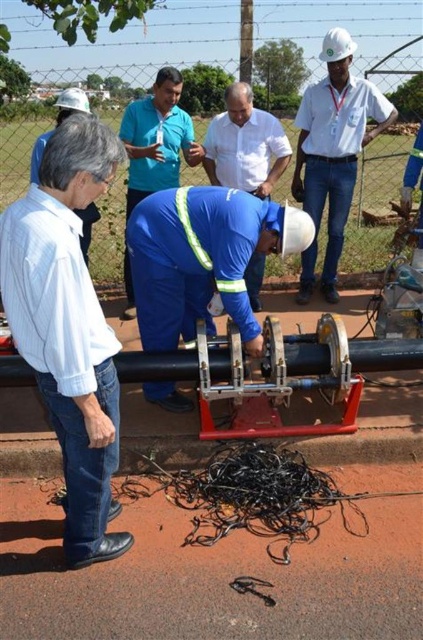
Does white shirt at left come behind white hard hat at upper left?

No, it is in front of white hard hat at upper left.

Is point (52, 188) positioned after point (74, 113)?

No, it is in front of (74, 113).

Where is `white shirt at left`? This screenshot has width=423, height=640. white shirt at left is located at coordinates (68, 326).

Is white hard hat at center below white hard hat at upper left?

Yes, white hard hat at center is below white hard hat at upper left.

Is point (332, 147) positioned after point (57, 104)?

Yes, it is.

The width and height of the screenshot is (423, 640). I want to click on white hard hat at center, so click(332, 152).

From the picture: Does white shirt at left appear on the right side of blue reflective safety vest at center?

In fact, white shirt at left is to the left of blue reflective safety vest at center.

The height and width of the screenshot is (640, 423). What do you see at coordinates (68, 326) in the screenshot? I see `white shirt at left` at bounding box center [68, 326].

Where is `white shirt at left`? white shirt at left is located at coordinates (68, 326).